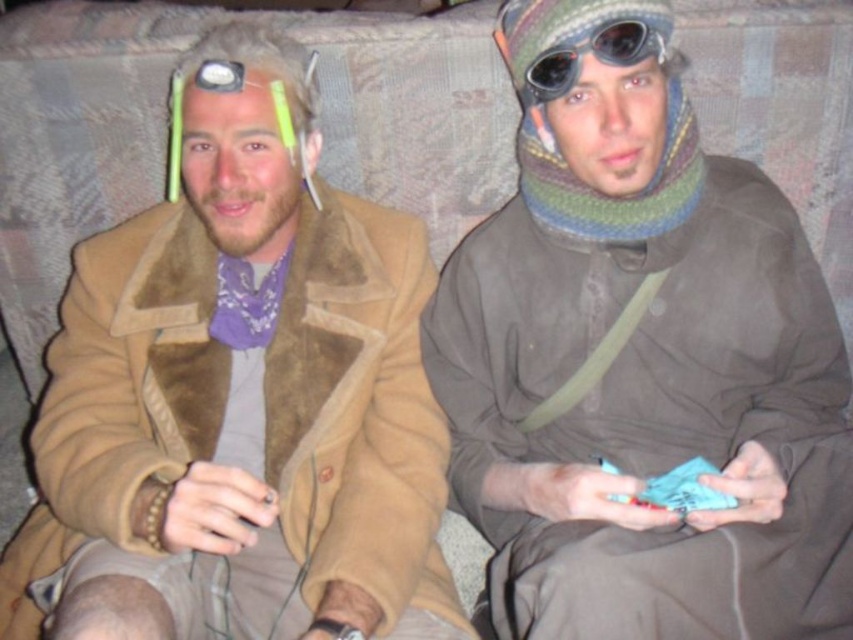
You are a photographer setting up a shoot in this scene. You need to position a light source so that it illuminates both the brown suede jacket at left and the black rubber goggles at upper center. Based on their positions, where should you place the light source relative to these objects?

The brown suede jacket at left is below the black rubber goggles at upper center. To illuminate both, the light source should be placed above the black rubber goggles at upper center so that the light can reach both the goggles above and the jacket below.

You are a photographer trying to capture a closeup of the black rubber goggles at upper center without including the multicolored knitted scarf at center in the frame. Is this possible given their sizes?

The multicolored knitted scarf at center has a greater height compared to black rubber goggles at upper center. Since the scarf is taller, it might block the view of the goggles unless adjusted. However, since the goggles are at upper center and the scarf is also at center, their positions might overlap. Without knowing their exact vertical positions, it is uncertain if the scarf will block the goggles. The answer cannot be definitively determined with the given information.